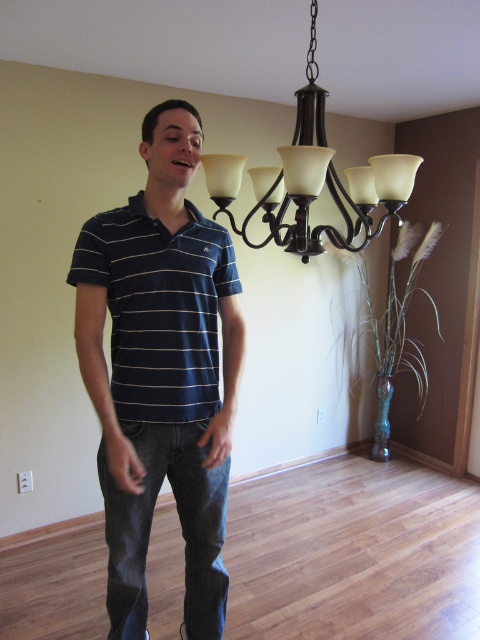
You are a photographer setting up a shoot in the living room. You need to position a model wearing the dark blue striped polo shirt at center so that they are directly under the matte black chandelier at upper center. Based on the scene description, is this possible? Explain your reasoning.

The dark blue striped polo shirt at center is located below the matte black chandelier at upper center, so positioning the model wearing the dark blue striped polo shirt at center directly under the matte black chandelier at upper center is feasible as they are already in that spatial relationship.

You are standing at the point labeled point (283, 170) and want to move to the point labeled point (129, 288). Which direction should you move to reach your destination?

You should move forward to reach point (129, 288) because it is in front of point (283, 170).